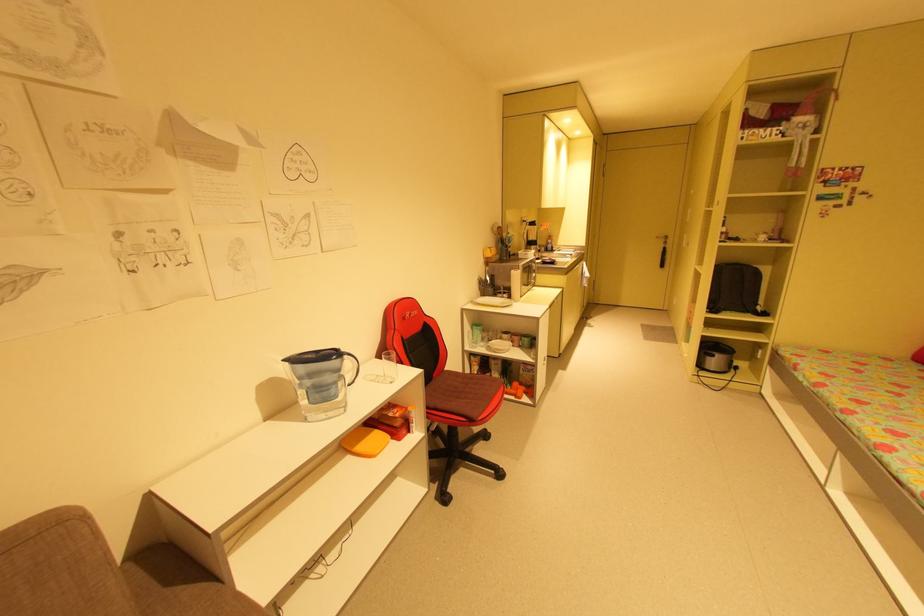
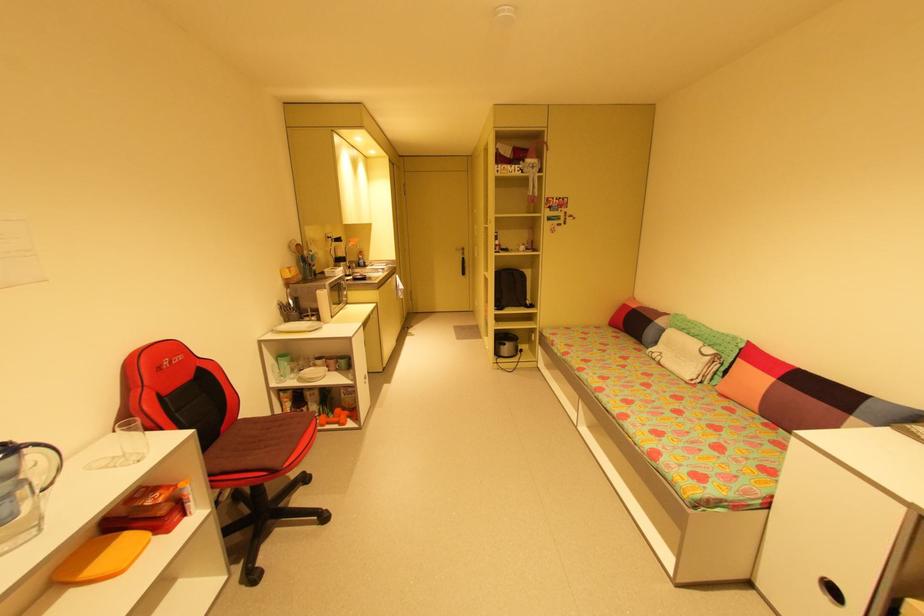
In the second image, find the point that corresponds to [450,369] in the first image.

(244, 418)